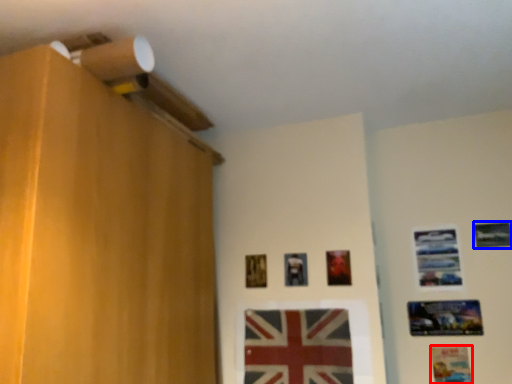
Question: Which of the following is the farthest to the observer, picture frame (highlighted by a red box) or picture frame (highlighted by a blue box)?

Choices:
 (A) picture frame
 (B) picture frame

Answer: (B)